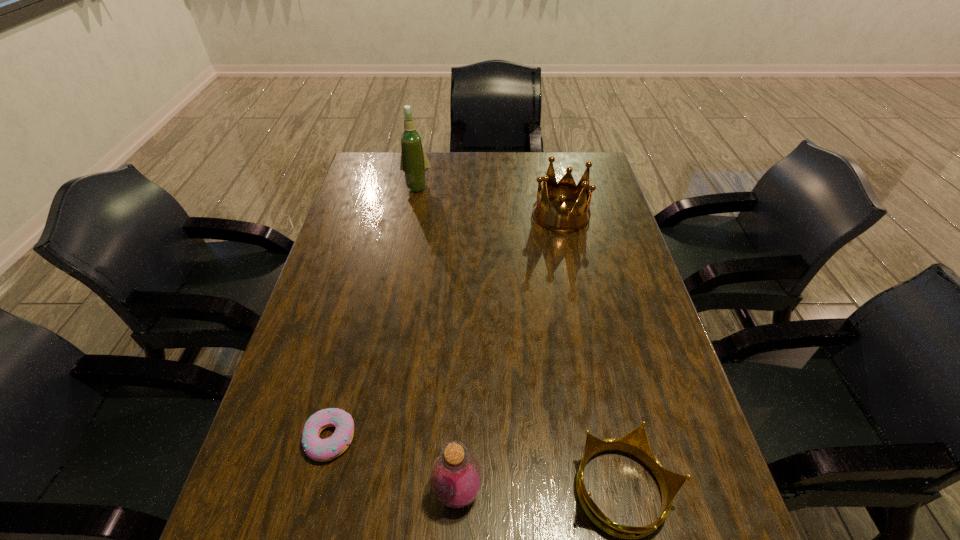
Locate which object is the fourth closest to the third object from left to right. Please provide its 2D coordinates. Your answer should be formatted as a tuple, i.e. [(x, y)], where the tuple contains the x and y coordinates of a point satisfying the conditions above.

[(414, 163)]

What are the coordinates of `object that is the second nearest to the nearer crown` in the screenshot? It's located at (x=322, y=450).

This screenshot has width=960, height=540. In order to click on vacant region that satisfies the following two spatial constraints: 1. on the front-facing side of the tallest object; 2. on the left side of the bottle in this screenshot , I will do `click(362, 491)`.